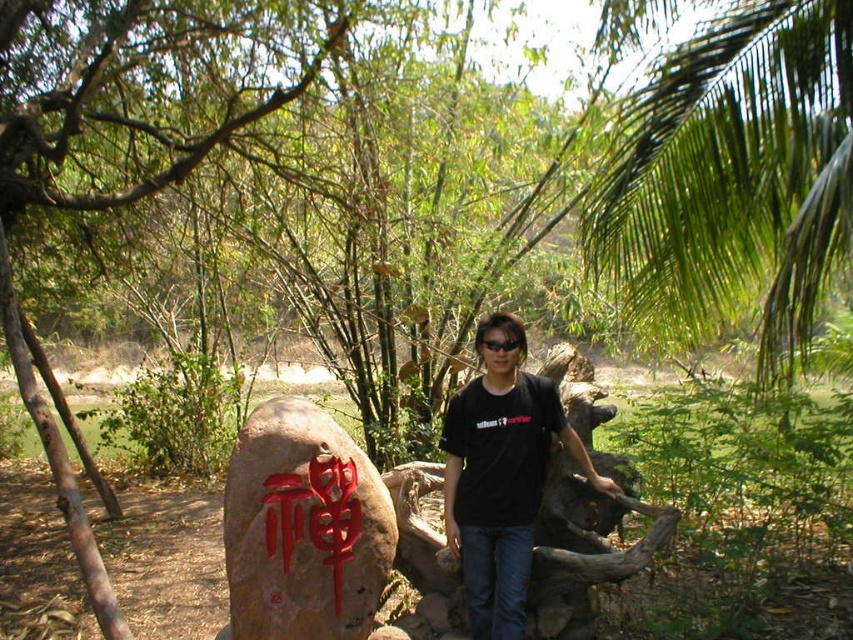
Question: Considering the relative positions of red carved stone at center and black plastic goggles at center in the image provided, where is red carved stone at center located with respect to black plastic goggles at center?

Choices:
 (A) left
 (B) right

Answer: (A)

Question: Based on their relative distances, which object is farther from the black matte t-shirt at center?

Choices:
 (A) red painted stone at center
 (B) black plastic goggles at center

Answer: (A)

Question: From the image, what is the correct spatial relationship of black matte t-shirt at center in relation to black plastic goggles at center?

Choices:
 (A) right
 (B) left

Answer: (A)

Question: Which point is closer to the camera?

Choices:
 (A) (341, 500)
 (B) (350, 460)
 (C) (467, 468)
 (D) (498, 342)

Answer: (D)

Question: Which of the following is the closest to the observer?

Choices:
 (A) (299, 632)
 (B) (474, 636)
 (C) (326, 506)
 (D) (490, 340)

Answer: (A)

Question: Can you confirm if black matte t-shirt at center is positioned to the left of black plastic goggles at center?

Choices:
 (A) yes
 (B) no

Answer: (B)